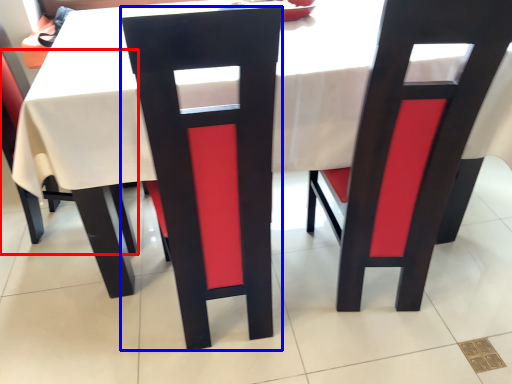
Question: Which point is closer to the camera, chair (highlighted by a red box) or chair (highlighted by a blue box)?

Choices:
 (A) chair
 (B) chair

Answer: (B)